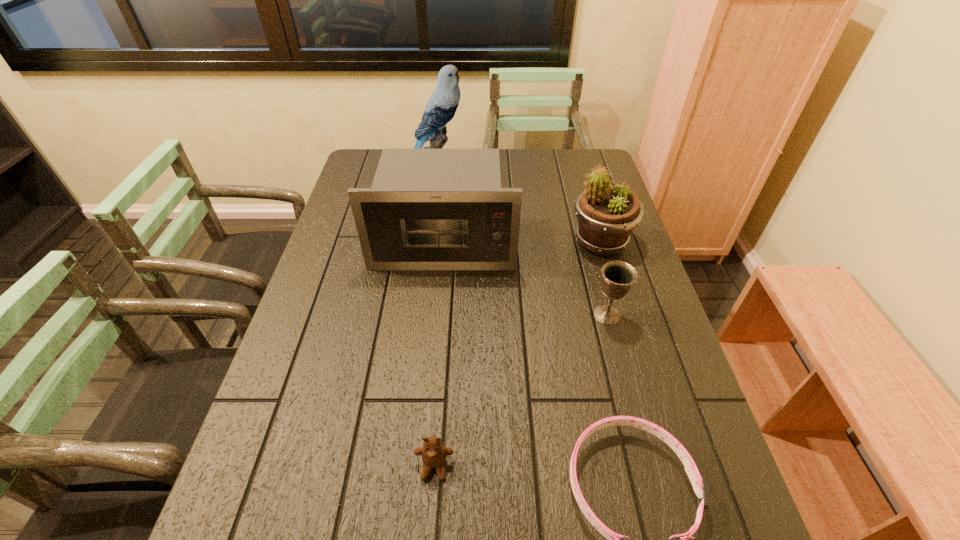
The width and height of the screenshot is (960, 540). Identify the location of the tallest object. (441, 107).

Locate an element on the screen. Image resolution: width=960 pixels, height=540 pixels. the farthest object is located at coordinates (441, 107).

At what (x,y) coordinates should I click in order to perform the action: click on microwave oven. Please return your answer as a coordinate pair (x, y). The image size is (960, 540). Looking at the image, I should click on (428, 209).

The height and width of the screenshot is (540, 960). I want to click on flowerpot, so tap(606, 214).

In order to click on chalice in this screenshot , I will do `click(618, 276)`.

What are the coordinates of `the fourth tallest object` in the screenshot? It's located at (618, 276).

Locate an element on the screen. This screenshot has width=960, height=540. teddy bear is located at coordinates (433, 453).

Locate an element on the screen. This screenshot has height=540, width=960. blank space located on the face of the parakeet is located at coordinates (540, 175).

The width and height of the screenshot is (960, 540). Identify the location of vacant space situated 0.100m on the front-facing side of the microwave oven. (439, 298).

Image resolution: width=960 pixels, height=540 pixels. I want to click on vacant area situated on the front of the flowerpot, so click(x=628, y=333).